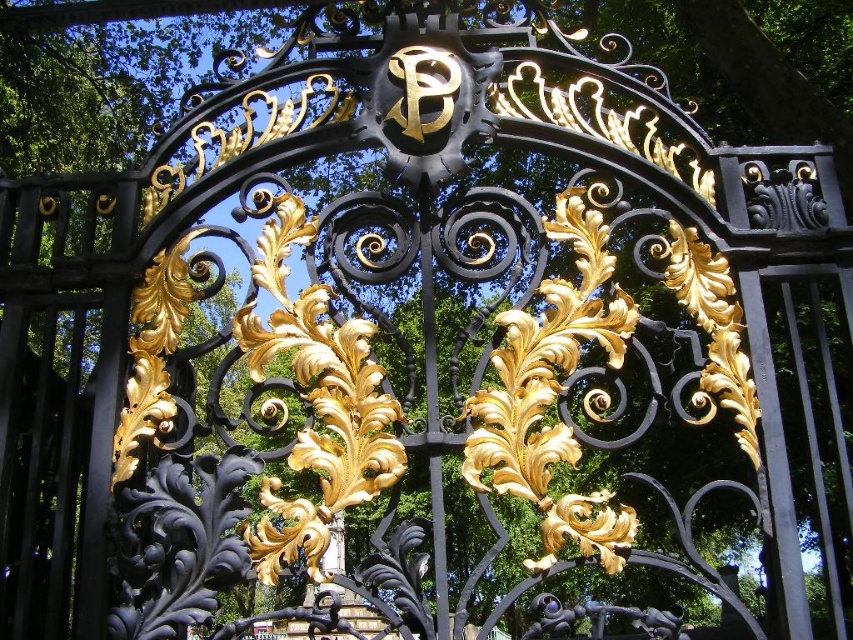
Does glossy gold leaf at center have a greater height compared to gold leaf design at center?

Indeed, glossy gold leaf at center has a greater height compared to gold leaf design at center.

In the scene shown: Which of these two, glossy gold leaf at center or gold leaf design at center, stands taller?

Standing taller between the two is glossy gold leaf at center.

Which is behind, point (318, 339) or point (701, 248)?

Positioned behind is point (701, 248).

Identify the location of glossy gold leaf at center. (315, 403).

Between gold leafy ornament at center and glossy gold leaf at center, which one has less height?

Standing shorter between the two is glossy gold leaf at center.

Who is more forward, (604, 323) or (328, 426)?

Positioned in front is point (328, 426).

Where is `gold leafy ornament at center`? gold leafy ornament at center is located at coordinates (553, 394).

Who is lower down, gold leafy ornament at center or gold leaf design at center?

Positioned lower is gold leafy ornament at center.

Is gold leafy ornament at center bigger than gold leaf design at center?

Indeed, gold leafy ornament at center has a larger size compared to gold leaf design at center.

Is point (556, 241) in front of point (712, 321)?

No, it is not.

Locate an element on the screen. The height and width of the screenshot is (640, 853). gold leafy ornament at center is located at coordinates (553, 394).